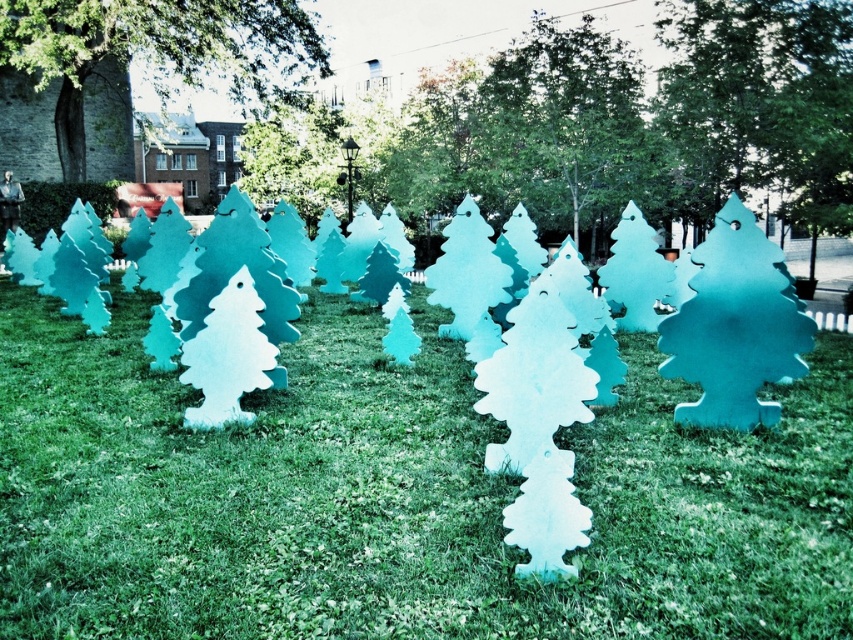
Question: Is matte white grass at center wider than smooth green tree at upper center?

Choices:
 (A) yes
 (B) no

Answer: (A)

Question: Based on their relative distances, which object is farther from the matte white grass at center?

Choices:
 (A) smooth green tree at upper center
 (B) matte teal tree at center

Answer: (A)

Question: Among these objects, which one is nearest to the camera?

Choices:
 (A) matte teal tree at center
 (B) matte white grass at center
 (C) smooth green tree at upper center

Answer: (B)

Question: Where is matte white grass at center located in relation to smooth green tree at upper center in the image?

Choices:
 (A) right
 (B) left

Answer: (A)

Question: Which point is closer to the camera?

Choices:
 (A) smooth green tree at upper center
 (B) matte white grass at center
 (C) matte teal tree at center

Answer: (B)

Question: Considering the relative positions of matte white grass at center and matte teal tree at center in the image provided, where is matte white grass at center located with respect to matte teal tree at center?

Choices:
 (A) below
 (B) above

Answer: (A)